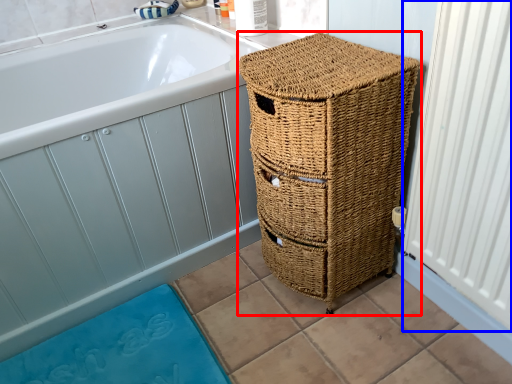
Question: Which object is further to the camera taking this photo, furniture (highlighted by a red box) or radiator (highlighted by a blue box)?

Choices:
 (A) furniture
 (B) radiator

Answer: (A)